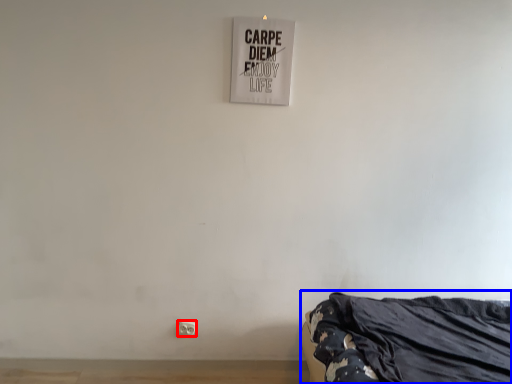
Question: Which object is closer to the camera taking this photo, electric outlet (highlighted by a red box) or furniture (highlighted by a blue box)?

Choices:
 (A) electric outlet
 (B) furniture

Answer: (B)